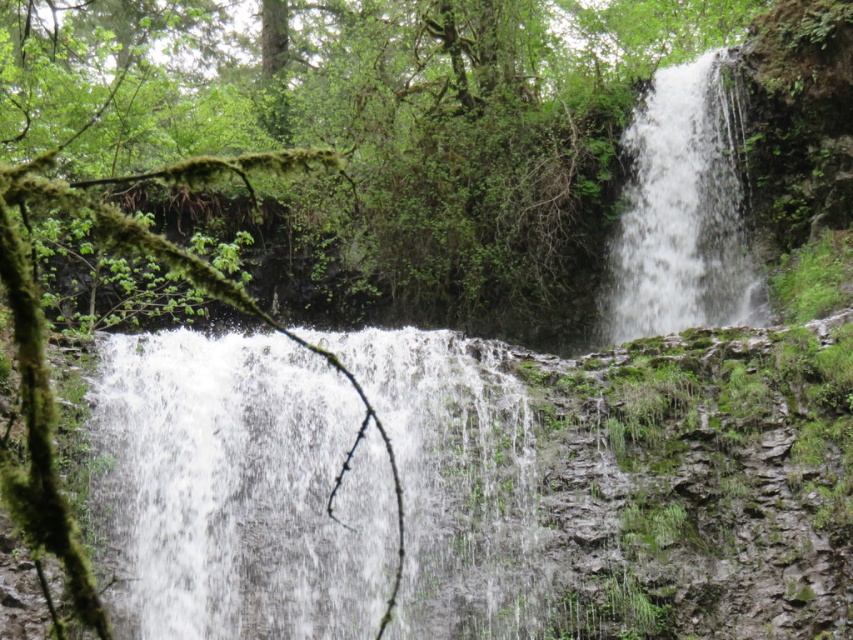
You are standing at the edge of a cliff overlooking the scene. You want to take a photo of the white frothy water at center. Given that your camera has a maximum focus range of 30 meters, will you be able to capture it clearly?

The white frothy water at center is 33.55 meters away from the camera, which exceeds the maximum focus range of 30 meters. Therefore, you will not be able to capture it clearly.

You are standing at the edge of the cliff and want to place a small weatherproof sensor at the exact location of the white frothy water at center. According to the coordinates provided, where should you place the sensor?

The sensor should be placed at the coordinates point [239,490] where the white frothy water at center is located.